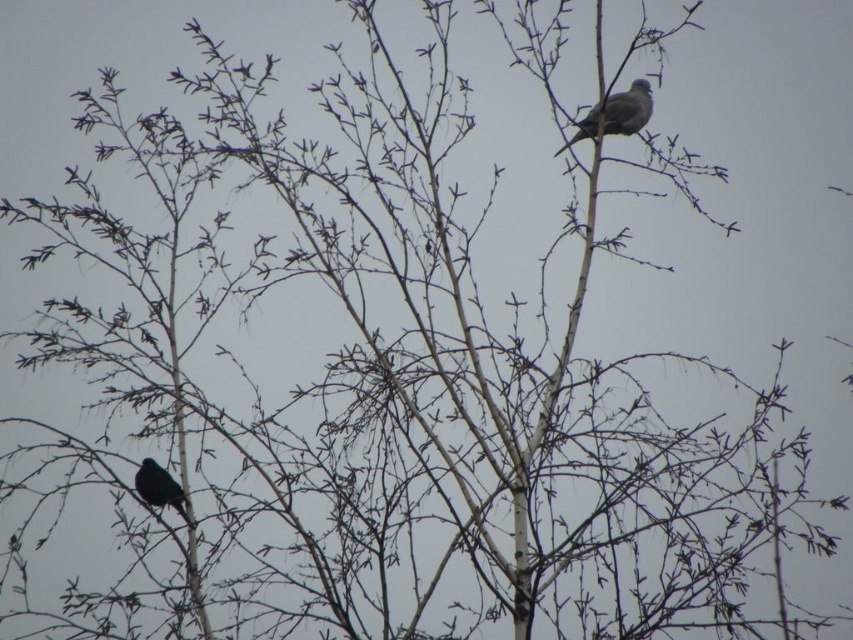
Question: Can you confirm if gray matte bird at upper center is wider than shiny black bird at lower left?

Choices:
 (A) no
 (B) yes

Answer: (B)

Question: Does gray matte bird at upper center appear under shiny black bird at lower left?

Choices:
 (A) yes
 (B) no

Answer: (B)

Question: Which object appears closest to the camera in this image?

Choices:
 (A) gray matte bird at upper center
 (B) shiny black bird at lower left

Answer: (B)

Question: Can you confirm if gray matte bird at upper center is smaller than shiny black bird at lower left?

Choices:
 (A) no
 (B) yes

Answer: (A)